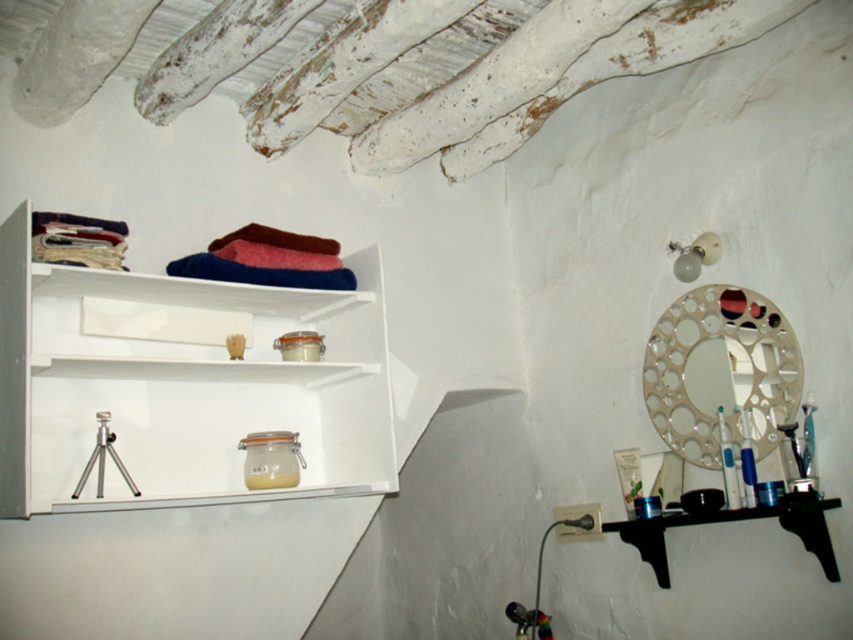
Question: Is metallic circular mirror at upper right to the right of black wood shelf at lower right from the viewer's perspective?

Choices:
 (A) yes
 (B) no

Answer: (A)

Question: Which point is closer to the camera taking this photo?

Choices:
 (A) (735, 516)
 (B) (200, 442)
 (C) (688, 348)

Answer: (A)

Question: Which point is farther to the camera?

Choices:
 (A) metallic circular mirror at upper right
 (B) black wood shelf at lower right

Answer: (A)

Question: Does white glossy shelves at upper left appear over black wood shelf at lower right?

Choices:
 (A) no
 (B) yes

Answer: (B)

Question: Which point is farther from the camera taking this photo?

Choices:
 (A) (833, 580)
 (B) (120, 492)

Answer: (B)

Question: Can you confirm if white glossy shelves at upper left is positioned to the left of black wood shelf at lower right?

Choices:
 (A) yes
 (B) no

Answer: (A)